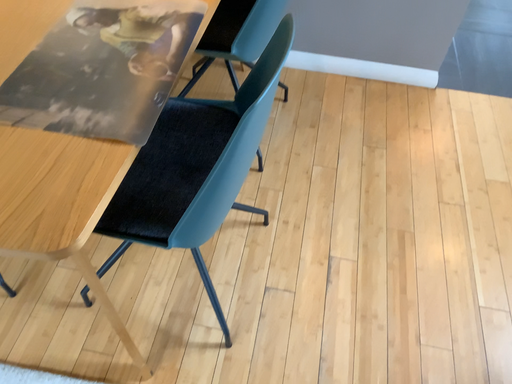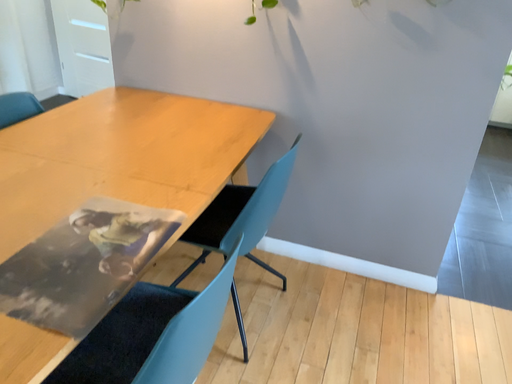
Question: Which way did the camera rotate in the video?

Choices:
 (A) rotated downward
 (B) rotated upward

Answer: (B)